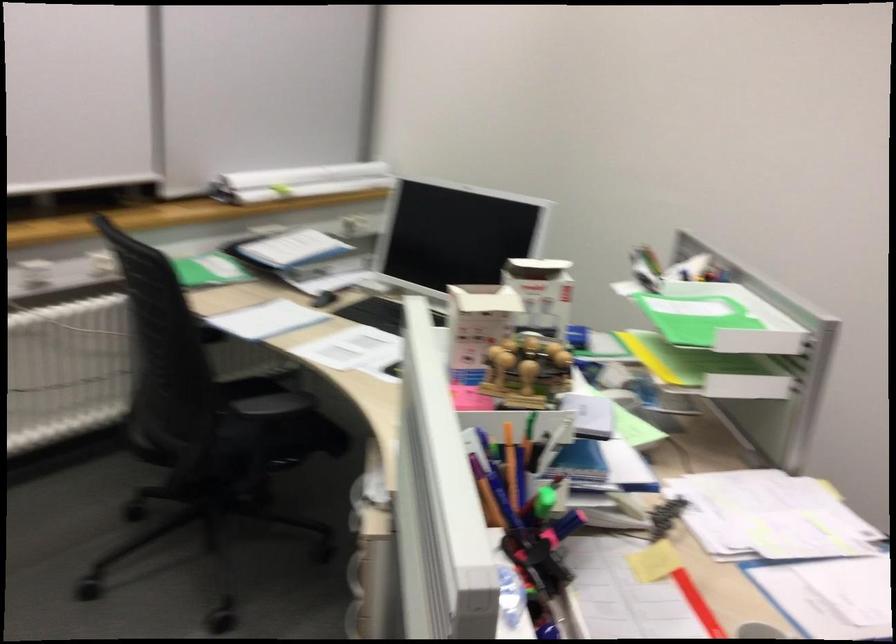
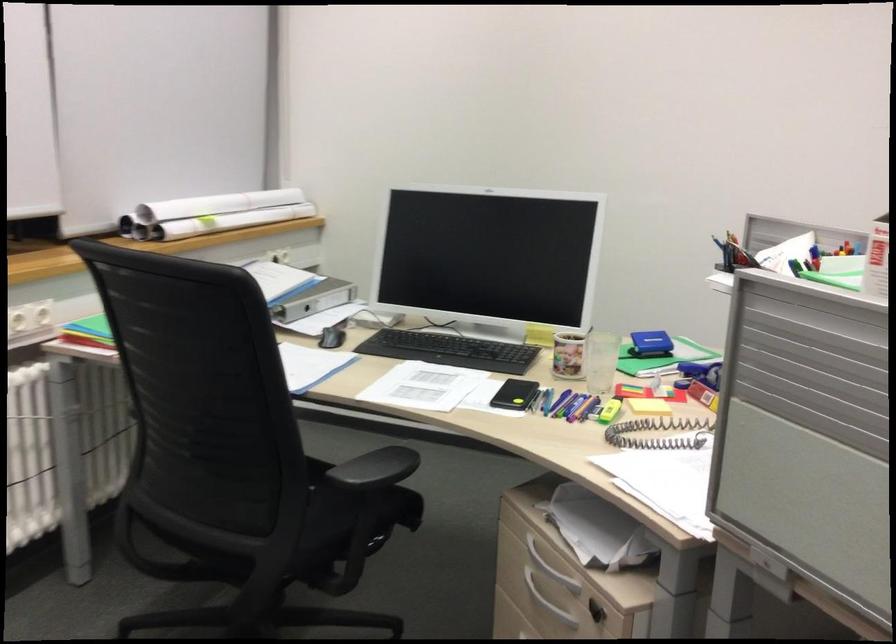
Where in the second image is the point corresponding to point (304, 431) from the first image?

(380, 498)